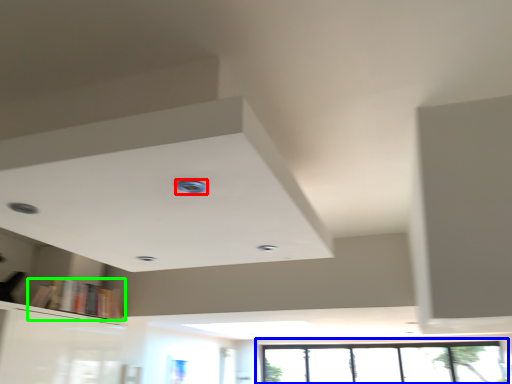
Question: Which object is the farthest from hole (highlighted by a red box)? Choose among these: window (highlighted by a blue box) or book (highlighted by a green box).

Choices:
 (A) window
 (B) book

Answer: (A)